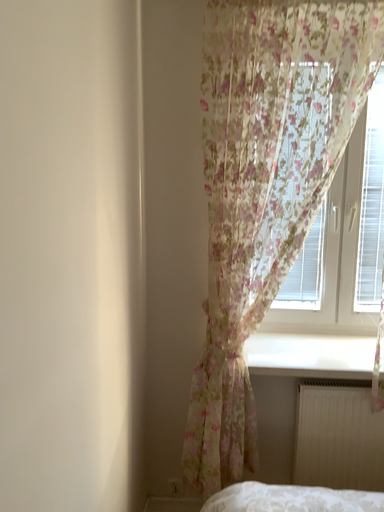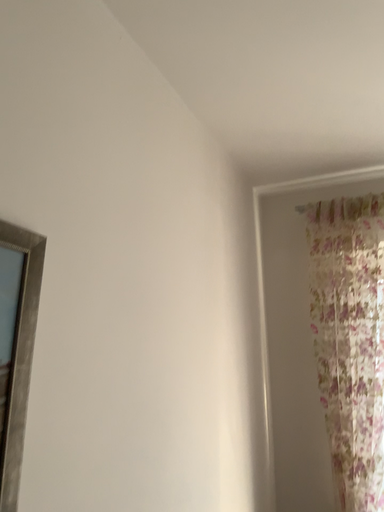
Question: How did the camera likely rotate when shooting the video?

Choices:
 (A) rotated upward
 (B) rotated downward

Answer: (A)